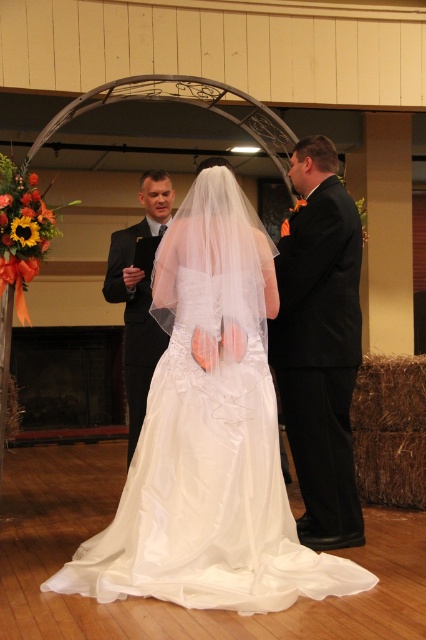
Question: Is white satin dress at center behind dark gray suit at center?

Choices:
 (A) no
 (B) yes

Answer: (A)

Question: Is black satin suit at right to the left of dark gray suit at center from the viewer's perspective?

Choices:
 (A) yes
 (B) no

Answer: (B)

Question: Does black satin suit at right appear over dark gray suit at center?

Choices:
 (A) yes
 (B) no

Answer: (B)

Question: Which object is closer to the camera taking this photo?

Choices:
 (A) dark gray suit at center
 (B) white satin dress at center

Answer: (B)

Question: Which of the following is the farthest from the observer?

Choices:
 (A) (111, 563)
 (B) (132, 240)
 (C) (290, 280)

Answer: (B)

Question: Which point is farther to the camera?

Choices:
 (A) white satin dress at center
 (B) black satin suit at right
 (C) dark gray suit at center

Answer: (C)